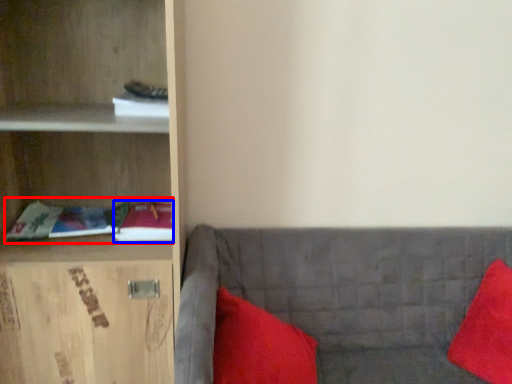
Question: Which object appears closest to the camera in this image, book (highlighted by a red box) or book (highlighted by a blue box)?

Choices:
 (A) book
 (B) book

Answer: (A)